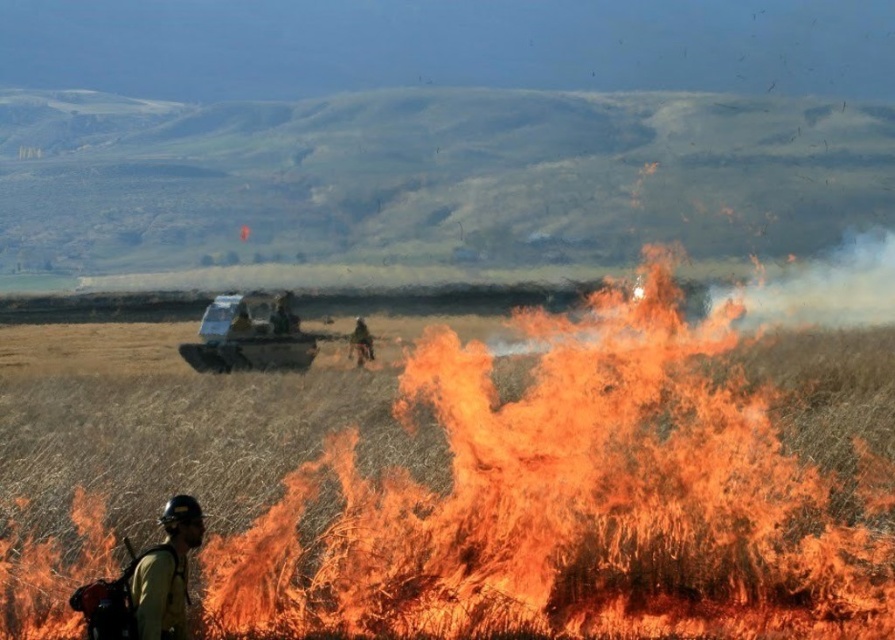
You are a firefighter assessing the controlled burn area. You see the grassy field at center and the matte silver tank at center. Which object is wider?

The grassy field at center is wider than the matte silver tank at center.

You are a firefighter trying to navigate through the grassy field at center and the camouflage fabric jacket at center. Which object is located to the right when facing the scene?

The grassy field at center is positioned on the right side of camouflage fabric jacket at center, so when facing the scene, the grassy field at center is to the right of the camouflage fabric jacket at center.